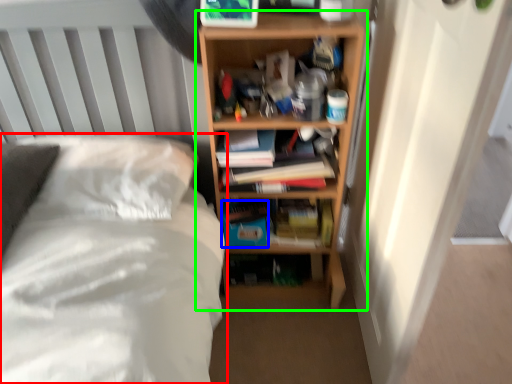
Question: Considering the real-world distances, which object is closest to bed (highlighted by a red box)? paperback book (highlighted by a blue box) or shelf (highlighted by a green box).

Choices:
 (A) paperback book
 (B) shelf

Answer: (A)